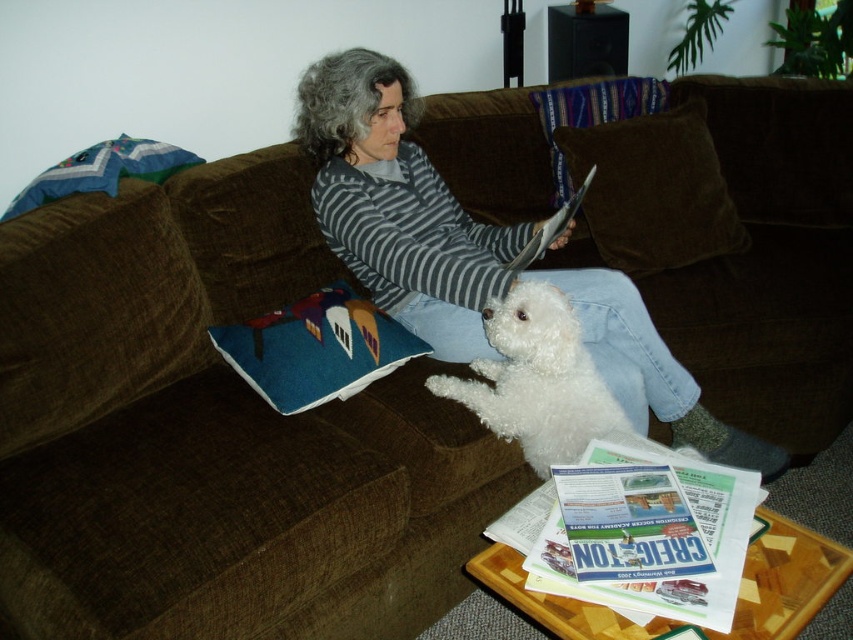
Between point (338, 131) and point (517, 269), which one is positioned behind?

The point (338, 131) is behind.

This screenshot has width=853, height=640. What do you see at coordinates (398, 205) in the screenshot? I see `striped cotton sweater at center` at bounding box center [398, 205].

Find the location of a particular element. Image resolution: width=853 pixels, height=640 pixels. striped cotton sweater at center is located at coordinates (398, 205).

Locate an element on the screen. striped cotton sweater at center is located at coordinates tap(398, 205).

Can you confirm if white glossy magazine at lower center is wider than matte paper magazine at center?

Yes.

Is white glossy magazine at lower center shorter than matte paper magazine at center?

Indeed, white glossy magazine at lower center has a lesser height compared to matte paper magazine at center.

Is point (724, 612) farther from camera compared to point (558, 227)?

No, (724, 612) is in front of (558, 227).

Locate an element on the screen. The height and width of the screenshot is (640, 853). white glossy magazine at lower center is located at coordinates (643, 582).

Is blue felt pillow at lower center bigger than matte paper magazine at center?

Indeed, blue felt pillow at lower center has a larger size compared to matte paper magazine at center.

Who is shorter, blue felt pillow at lower center or matte paper magazine at center?

blue felt pillow at lower center is shorter.

Who is more distant from viewer, (372,321) or (524,256)?

Positioned behind is point (524,256).

This screenshot has height=640, width=853. Identify the location of blue felt pillow at lower center. (316, 348).